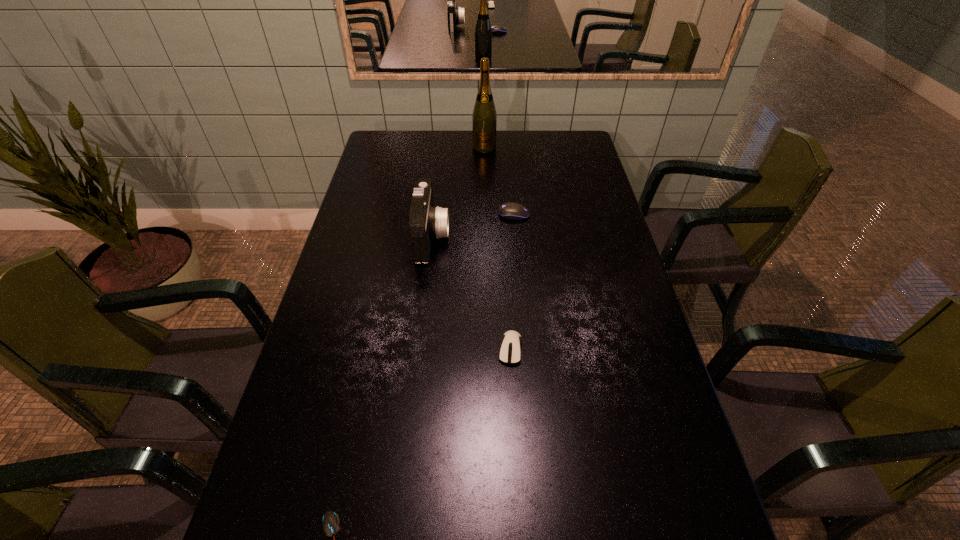
I want to click on wine bottle, so click(484, 119).

Identify the location of the tallest object. (484, 119).

Find the location of a particular element. This screenshot has width=960, height=540. the fourth object from right to left is located at coordinates (426, 222).

The width and height of the screenshot is (960, 540). Identify the location of the fourth shortest object. (426, 222).

Where is `the fourth farthest object`? This screenshot has width=960, height=540. the fourth farthest object is located at coordinates (510, 348).

The height and width of the screenshot is (540, 960). What are the coordinates of `the farthest mouse` in the screenshot? It's located at (513, 211).

This screenshot has width=960, height=540. I want to click on vacant space located 0.120m on the front-facing side of the wine bottle, so click(485, 170).

Where is `vacant region located on the lens of the camcorder`? vacant region located on the lens of the camcorder is located at coordinates (495, 237).

Locate an element on the screen. This screenshot has height=540, width=960. free spot located on the back of the second farthest mouse is located at coordinates (506, 275).

Where is `blank space located on the left of the farthest mouse`? The width and height of the screenshot is (960, 540). blank space located on the left of the farthest mouse is located at coordinates (431, 214).